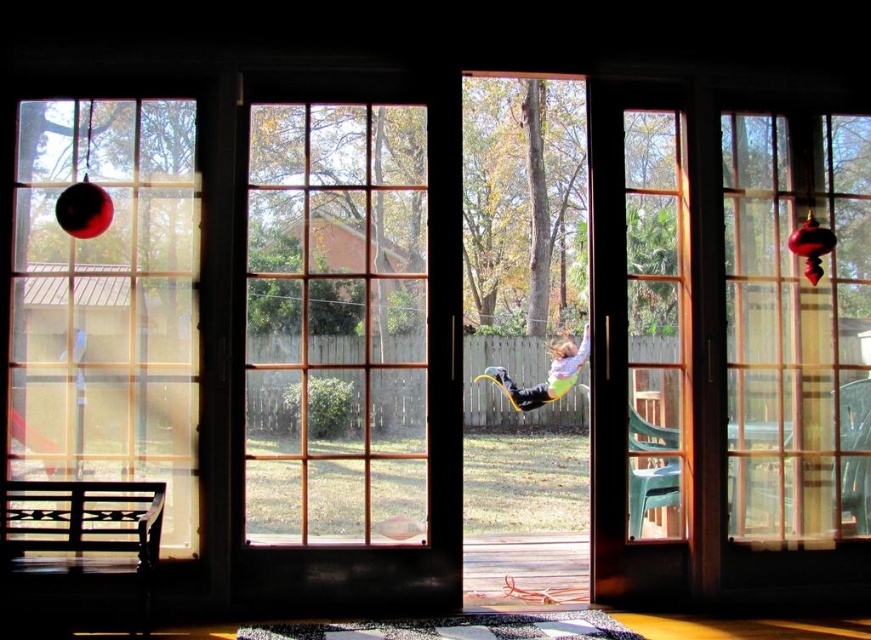
Which is below, multicolored plastic swing at center or shiny red ornament at left?

multicolored plastic swing at center is lower down.

This screenshot has height=640, width=871. What do you see at coordinates (545, 376) in the screenshot?
I see `multicolored plastic swing at center` at bounding box center [545, 376].

Locate an element on the screen. The height and width of the screenshot is (640, 871). multicolored plastic swing at center is located at coordinates [545, 376].